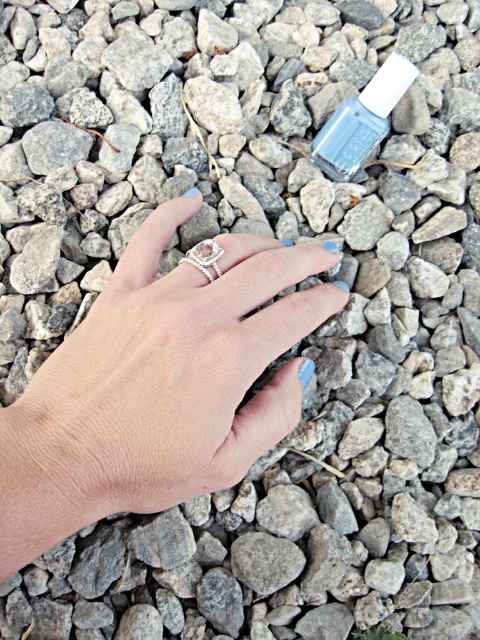
Question: Which is farther from the matte gray nail polish at upper center?

Choices:
 (A) silver metallic ring at center
 (B) matte silver ring at center

Answer: (B)

Question: Can you confirm if matte gray nail polish at upper center is positioned to the left of silver metallic ring at center?

Choices:
 (A) yes
 (B) no

Answer: (B)

Question: Estimate the real-world distances between objects in this image. Which object is farther from the silver metallic ring at center?

Choices:
 (A) matte gray nail polish at upper center
 (B) matte silver ring at center

Answer: (A)

Question: Is matte silver ring at center wider than matte gray nail polish at upper center?

Choices:
 (A) no
 (B) yes

Answer: (B)

Question: Does matte silver ring at center appear on the right side of silver metallic ring at center?

Choices:
 (A) yes
 (B) no

Answer: (B)

Question: Which is nearer to the silver metallic ring at center?

Choices:
 (A) matte silver ring at center
 (B) matte gray nail polish at upper center

Answer: (A)